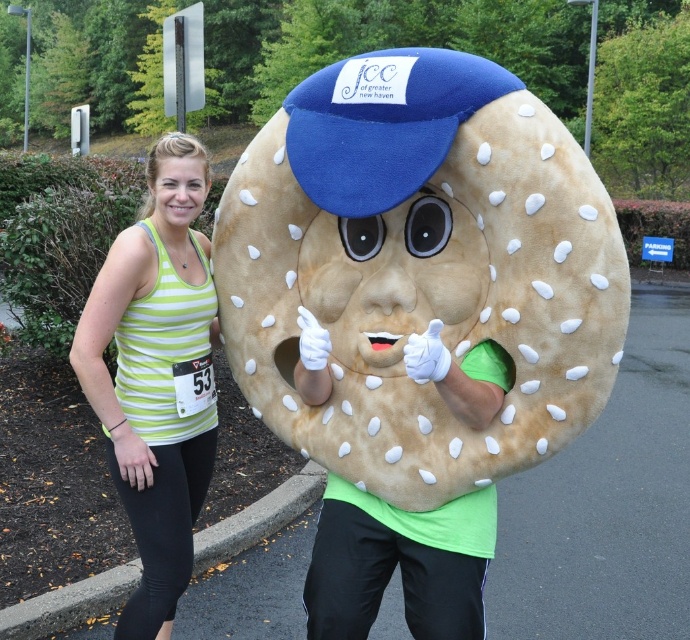
You are a photographer at a race event. You need to capture a photo of the green striped tank top at center without the brown plush bagel at center blocking it. Is this possible given their positions?

The brown plush bagel at center is positioned over the green striped tank top at center, so it is blocking the view. You cannot capture a clear photo of the green striped tank top at center without the brown plush bagel at center blocking it.

You are organizing a costume parade and need to ensure all participants can walk side by side without any obstacles. Given the sizes of the brown plush bagel at center and the green striped tank top at center, which participant should be positioned closer to the edge of the path to avoid blocking others?

The brown plush bagel at center has a smaller size compared to the green striped tank top at center, so the green striped tank top at center should be positioned closer to the edge to allow more space for the smaller bagel costume.

You are standing at the starting line of the race and see two points marked on the ground. The first point is at coordinate point[335,433] and the second point is at coordinate point[150,465]. Which point is closer to you?

Point[335,433] is in front of point[150,465], so the first point is closer to you.